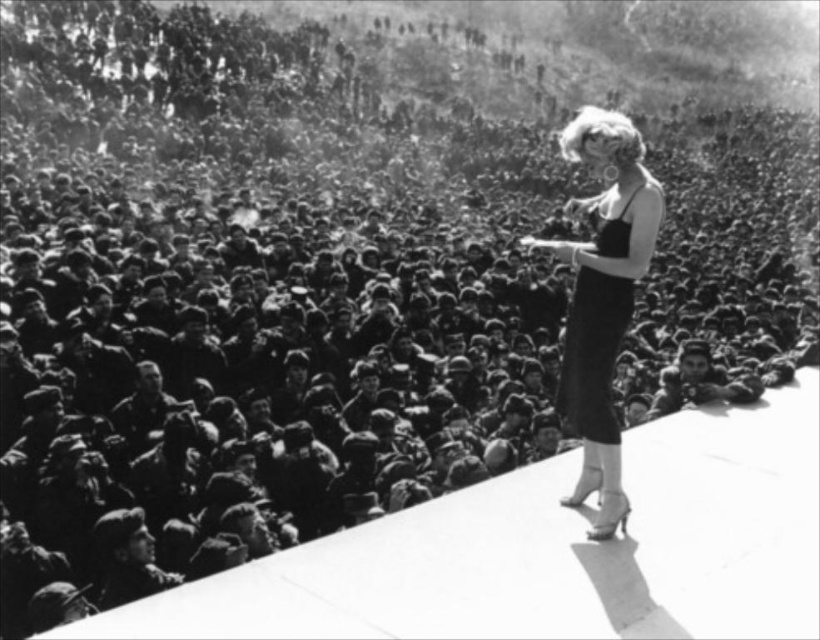
You are a photographer trying to capture a clear shot of the woman in the black satin dress at center and the one in the satin black dress at upper right. Which dress is positioned closer to the camera?

The black satin dress at center is closer to the viewer than the satin black dress at upper right, so the black satin dress at center would appear larger in the photo.

You are a photographer trying to capture a clear shot of the woman in the black satin dress at center and the person in the satin black dress at upper right. Since you can only focus on one subject at a time, which one would you choose to ensure the dress is fully visible in the photo?

The black satin dress at center is taller than the satin black dress at upper right, so focusing on the black satin dress at center would ensure it is fully visible in the photo.